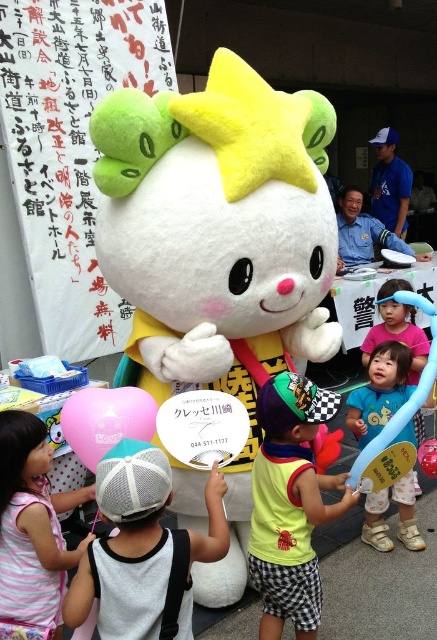
You are standing at point [218,252] in the image. What object is located exactly at this point?

The fluffy plush toy at center is located exactly at point [218,252].

Looking at this image, where is the blue fabric balloon at lower right located in the image?

The blue fabric balloon at lower right is located at point (380, 392) in the image.